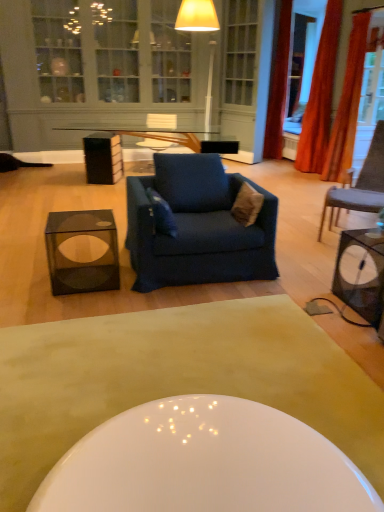
Describe the element at coordinates (79, 262) in the screenshot. I see `transparent glass cube at lower left, the second table when ordered from right to left` at that location.

Find the location of a particular element. Image resolution: width=384 pixels, height=512 pixels. matte glass cabinet at upper center is located at coordinates (59, 50).

In order to click on matte black cube at center, acting as the 1th coffee table starting from the top in this screenshot , I will do `click(187, 141)`.

Image resolution: width=384 pixels, height=512 pixels. Find the location of `blue fabric armchair at center`. blue fabric armchair at center is located at coordinates (161, 121).

In order to click on orange fabric curtain at right, which ranks as the 2th curtain in back-to-front order in this screenshot , I will do `click(320, 96)`.

Image resolution: width=384 pixels, height=512 pixels. Identify the location of transparent glass cube at lower left, which is the 1th table in left-to-right order. (79, 262).

Is point (111, 61) farther from viewer compared to point (77, 216)?

That is True.

Is matte glass cabinet at upper center aimed at transparent glass cube at lower left, the second table when ordered from right to left?

Yes.

In terms of width, does matte glass cabinet at upper center look wider or thinner when compared to transparent glass cube at lower left, which is the 1th table in left-to-right order?

Clearly, matte glass cabinet at upper center has less width compared to transparent glass cube at lower left, which is the 1th table in left-to-right order.

Between matte glass cabinet at upper center and transparent glass cube at lower left, which is the 1th table in left-to-right order, which one appears on the right side from the viewer's perspective?

From the viewer's perspective, transparent glass cube at lower left, which is the 1th table in left-to-right order, appears more on the right side.

Is blue fabric armchair at center directly adjacent to white glossy coffee table at center, which is the 1th coffee table from front to back?

Result: They are not placed beside each other.

This screenshot has width=384, height=512. I want to click on the 2nd coffee table to the right when counting from the blue fabric armchair at center, so click(176, 379).

Is blue fabric armchair at center facing towards white glossy coffee table at center, the second coffee table viewed from the top?

Yes, blue fabric armchair at center is aimed at white glossy coffee table at center, the second coffee table viewed from the top.

Is the depth of blue fabric armchair at center less than that of white glossy coffee table at center, arranged as the first coffee table when ordered from the bottom?

No, blue fabric armchair at center is further to the viewer.

Does orange fabric curtain at right, the 3th curtain when ordered from back to front, contain transparent glass cube at lower left, the second table when ordered from right to left?

Definitely not — transparent glass cube at lower left, the second table when ordered from right to left, is not inside orange fabric curtain at right, the 3th curtain when ordered from back to front.

Between point (364, 53) and point (96, 263), which one is positioned in front?

Point (96, 263)

Is orange fabric curtain at right, the 1th curtain from the front, oriented towards transparent glass cube at lower left, which is the 1th table in left-to-right order?

No.

From a real-world perspective, which is physically above, orange fabric curtain at right, the 1th curtain from the front, or transparent glass cube at lower left, which is the 1th table in left-to-right order?

orange fabric curtain at right, the 1th curtain from the front, is physically above.

Is white glossy coffee table at center, which is the 1th coffee table from front to back, not close to transparent glass cube at lower left, the second table when ordered from right to left?

Actually, white glossy coffee table at center, which is the 1th coffee table from front to back, and transparent glass cube at lower left, the second table when ordered from right to left, are a little close together.

Is white glossy coffee table at center, arranged as the first coffee table when ordered from the bottom, to the left or to the right of transparent glass cube at lower left, the second table when ordered from right to left, in the image?

In the image, white glossy coffee table at center, arranged as the first coffee table when ordered from the bottom, appears on the right side of transparent glass cube at lower left, the second table when ordered from right to left.

Is white glossy coffee table at center, arranged as the first coffee table when ordered from the bottom, positioned with its back to transparent glass cube at lower left, which is the 1th table in left-to-right order?

No, transparent glass cube at lower left, which is the 1th table in left-to-right order, is not at the back of white glossy coffee table at center, arranged as the first coffee table when ordered from the bottom.

How different are the orientations of brown fuzzy pillow at center, which ranks as the 1th pillow in right-to-left order, and orange fabric curtain at right, arranged as the 2th curtain when viewed from the front, in degrees?

They differ by 1.34 degrees in their facing directions.

Are brown fuzzy pillow at center, which ranks as the 1th pillow in right-to-left order, and orange fabric curtain at right, which ranks as the 2th curtain in back-to-front order, located far from each other?

Yes, brown fuzzy pillow at center, which ranks as the 1th pillow in right-to-left order, is far from orange fabric curtain at right, which ranks as the 2th curtain in back-to-front order.

At what (x,y) coordinates should I click in order to perform the action: click on the 1st pillow to the left of the orange fabric curtain at right, arranged as the 2th curtain when viewed from the front, starting your count from the anchor. Please return your answer as a coordinate pair (x, y). Looking at the image, I should click on (247, 205).

In the image, is white glossy coffee table at center, positioned as the second coffee table in back-to-front order, positioned in front of or behind metallic black table at right, which is the second table in left-to-right order?

In the image, white glossy coffee table at center, positioned as the second coffee table in back-to-front order, appears in front of metallic black table at right, which is the second table in left-to-right order.

Locate an element on the screen. coffee table that is under the metallic black table at right, placed as the first table when sorted from right to left (from a real-world perspective) is located at coordinates (176, 379).

Looking at this image, which is farther from the camera, (323,344) or (343,284)?

The point (343,284) is more distant.

From a real-world perspective, relative to metallic black table at right, placed as the first table when sorted from right to left, is white glossy coffee table at center, arranged as the first coffee table when ordered from the bottom, vertically above or below?

From a real-world perspective, white glossy coffee table at center, arranged as the first coffee table when ordered from the bottom, is physically below metallic black table at right, placed as the first table when sorted from right to left.

Who is shorter, blue fabric armchair at center or matte glass cabinet at upper center?

blue fabric armchair at center.

Considering the relative positions of blue fabric armchair at center and matte glass cabinet at upper center in the image provided, is blue fabric armchair at center in front of matte glass cabinet at upper center?

No.

Which is nearer, (158, 119) or (78, 83)?

Point (158, 119) appears to be farther away from the viewer than point (78, 83).

Who is smaller, blue fabric armchair at center or matte glass cabinet at upper center?

Smaller between the two is blue fabric armchair at center.

Locate an element on the screen. This screenshot has height=512, width=384. cabinetry behind the transparent glass cube at lower left, which is the 1th table in left-to-right order is located at coordinates (59, 50).

Where is `the 2nd coffee table to the right when counting from the blue fabric armchair at center`? Image resolution: width=384 pixels, height=512 pixels. the 2nd coffee table to the right when counting from the blue fabric armchair at center is located at coordinates (176, 379).

Estimate the real-world distances between objects in this image. Which object is closer to transparent glass cube at lower left, which is the 1th table in left-to-right order, dark brown fabric chair at right or matte glass cabinet at upper center?

dark brown fabric chair at right is positioned closer to the anchor transparent glass cube at lower left, which is the 1th table in left-to-right order.

Based on their spatial positions, is velvet blue pillow at center, the first pillow positioned from the left, or white glossy coffee table at center, the second coffee table viewed from the top, closer to orange fabric curtain at right, which ranks as the 2th curtain in back-to-front order?

velvet blue pillow at center, the first pillow positioned from the left, is positioned closer to the anchor orange fabric curtain at right, which ranks as the 2th curtain in back-to-front order.

Consider the image. From the image, which object appears to be nearer to white glossy coffee table at center, the second coffee table viewed from the top, dark blue fabric couch at center or transparent glass cube at lower left, which is the 1th table in left-to-right order?

Among the two, dark blue fabric couch at center is located nearer to white glossy coffee table at center, the second coffee table viewed from the top.

Considering their positions, is metallic black table at right, which is the second table in left-to-right order, positioned closer to brown fuzzy pillow at center, positioned as the 2th pillow in left-to-right order, than matte black cube at center, marked as the second coffee table in a bottom-to-top arrangement?

metallic black table at right, which is the second table in left-to-right order, lies closer to brown fuzzy pillow at center, positioned as the 2th pillow in left-to-right order, than the other object.

From the image, which object appears to be farther from transparent glass cube at lower left, the second table when ordered from right to left, brown fuzzy pillow at center, positioned as the 2th pillow in left-to-right order, or matte glass cabinet at upper center?

Based on the image, matte glass cabinet at upper center appears to be further to transparent glass cube at lower left, the second table when ordered from right to left.

Considering their positions, is orange fabric curtain at right, the 1th curtain from the front, positioned closer to dark blue fabric couch at center than dark brown fabric chair at right?

dark brown fabric chair at right is positioned closer to the anchor dark blue fabric couch at center.

Which object lies further to the anchor point white glossy coffee table at center, positioned as the second coffee table in back-to-front order, orange fabric curtain at upper right, which is the third curtain in front-to-back order, or dark blue fabric couch at center?

The object further to white glossy coffee table at center, positioned as the second coffee table in back-to-front order, is orange fabric curtain at upper right, which is the third curtain in front-to-back order.

Estimate the real-world distances between objects in this image. Which object is further from dark blue fabric couch at center, transparent glass cube at lower left, which is the 1th table in left-to-right order, or blue fabric armchair at center?

Among the two, blue fabric armchair at center is located further to dark blue fabric couch at center.

At what (x,y) coordinates should I click in order to perform the action: click on table located between metallic black table at right, which is the second table in left-to-right order, and orange fabric curtain at upper right, which is the 1th curtain in back-to-front order, in the depth direction. Please return your answer as a coordinate pair (x, y). Looking at the image, I should click on (79, 262).

Where is `coffee table between white glossy coffee table at center, the second coffee table viewed from the top, and orange fabric curtain at upper right, which is the third curtain in front-to-back order, along the z-axis`? The image size is (384, 512). coffee table between white glossy coffee table at center, the second coffee table viewed from the top, and orange fabric curtain at upper right, which is the third curtain in front-to-back order, along the z-axis is located at coordinates (187, 141).

Find the location of `table located between dark blue fabric couch at center and blue fabric armchair at center in the depth direction`. table located between dark blue fabric couch at center and blue fabric armchair at center in the depth direction is located at coordinates (79, 262).

This screenshot has width=384, height=512. Identify the location of curtain located between matte glass cabinet at upper center and orange fabric curtain at right, which ranks as the 2th curtain in back-to-front order, in the left-right direction. (278, 86).